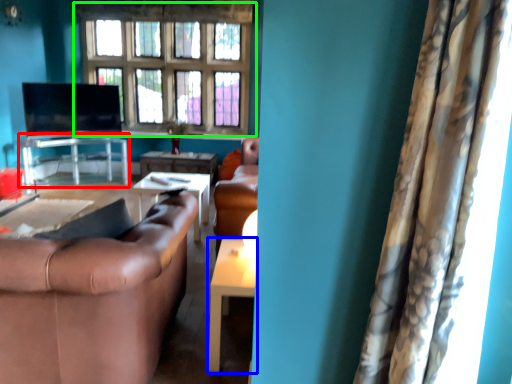
Question: Estimate the real-world distances between objects in this image. Which object is farther from table (highlighted by a red box), table (highlighted by a blue box) or window (highlighted by a green box)?

Choices:
 (A) table
 (B) window

Answer: (A)